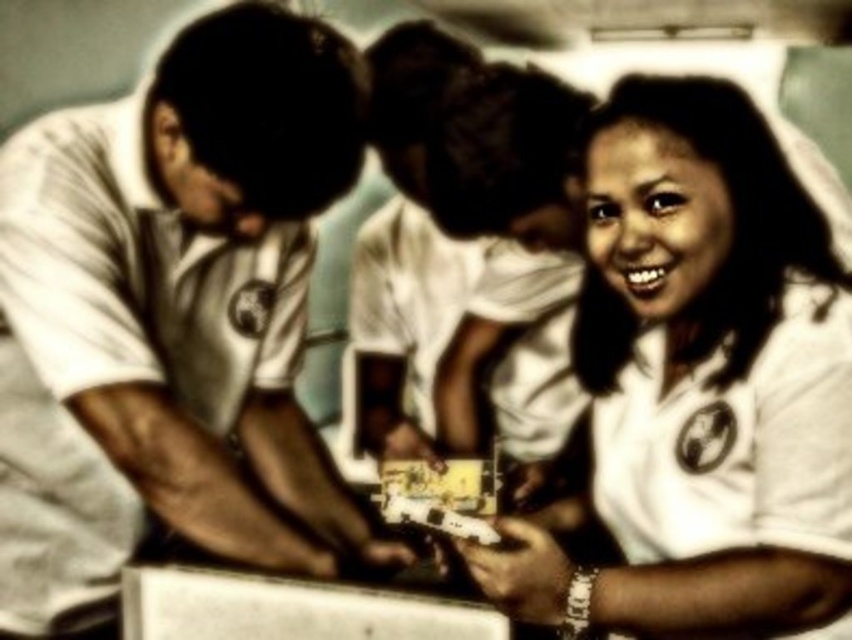
Question: Is white matte shirt at left wider than white matte shirt at center?

Choices:
 (A) yes
 (B) no

Answer: (A)

Question: Which object is closer to the camera taking this photo?

Choices:
 (A) white matte shirt at left
 (B) white matte shirt at center

Answer: (B)

Question: Does white matte shirt at left have a smaller size compared to white matte shirt at center?

Choices:
 (A) yes
 (B) no

Answer: (B)

Question: Is white matte shirt at left above white matte shirt at center?

Choices:
 (A) no
 (B) yes

Answer: (B)

Question: Which point is farther to the camera?

Choices:
 (A) white matte shirt at center
 (B) white matte shirt at left

Answer: (B)